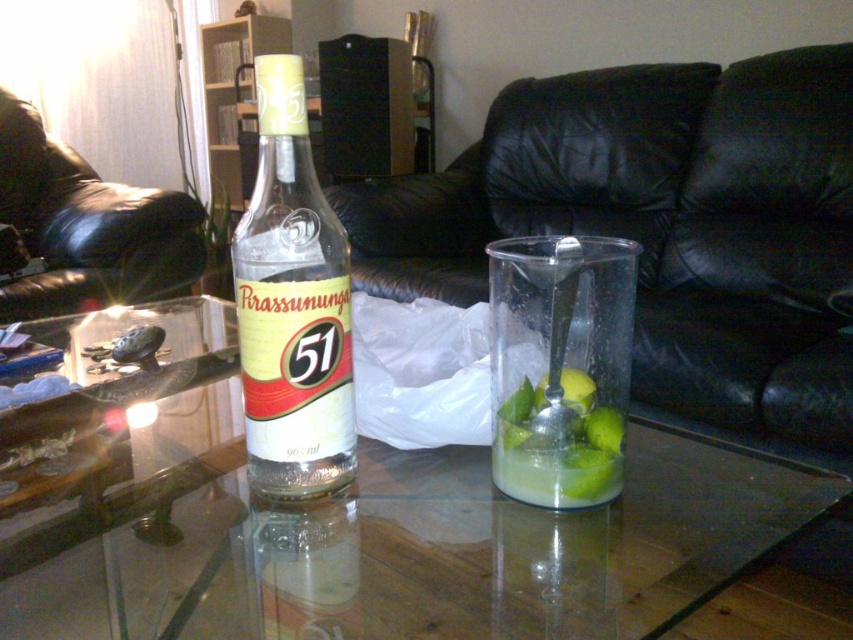
You are a guest at a party and want to place a small plate on the transparent glass table at center without it tipping over. Considering the clear glass bottle at center is already on the table, would the table be stable enough?

The transparent glass table at center has a lesser height compared to clear glass bottle at center, meaning the table is shorter than the bottle. Since the bottle is taller than the table, it might be unsteady if placed on the table, so the plate might tip over.

You are a guest in this living room and want to place a small plant on the floor between the black leather couch at left and the green matte lime at center. Considering their heights, which object should the plant be placed closer to?

The plant should be placed closer to the green matte lime at center because the black leather couch at left is taller than the green matte lime at center, so the area near the shorter lime might provide better visibility and balance.